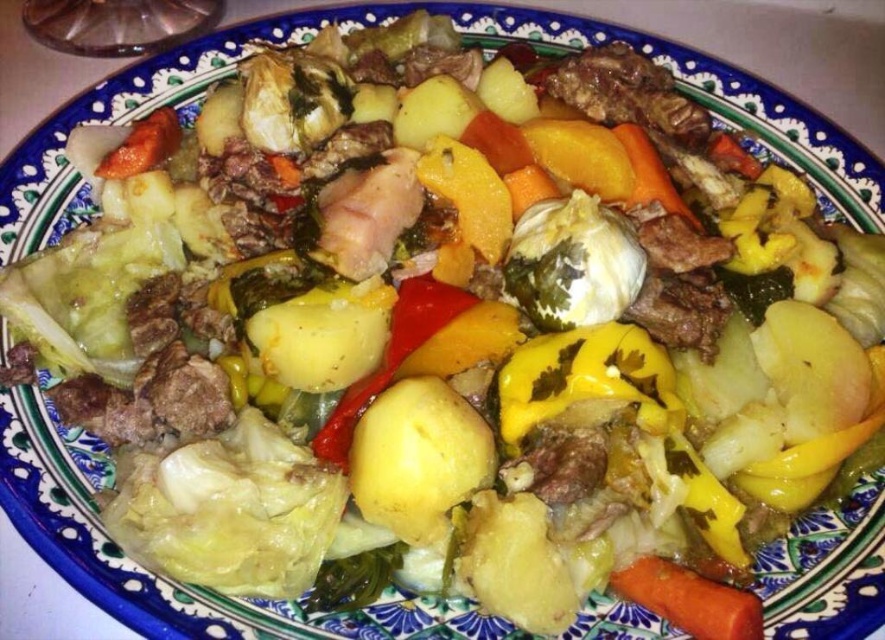
You are a food critic sitting at a table 4 feet away from the plate. You want to reach the green leafy cabbage at center to taste it. Can you reach it without moving your chair?

The green leafy cabbage at center is 3.51 feet away from the viewer. Since you are sitting 4 feet away from the plate, the cabbage is slightly closer than your distance from the plate. Depending on your arm length, you might be able to reach it without moving your chair, but it could be a bit of a stretch.

You are a chef trying to locate two specific points on the plate to adjust seasoning. The first point is at coordinate point (641,604) and the second is at point (120,145). Which point is closer to you when standing directly in front of the plate?

Point (641,604) is in front of point (120,145), so the first point is closer to you.